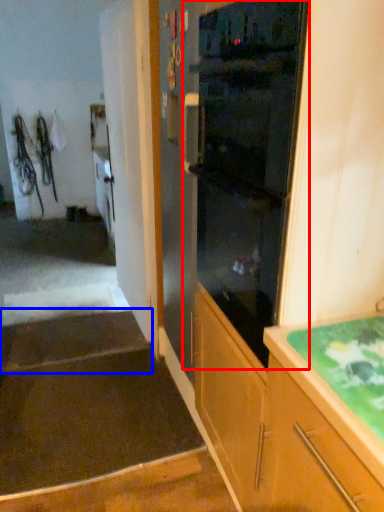
Question: Which of the following is the closest to the observer, home appliance (highlighted by a red box) or stairwell (highlighted by a blue box)?

Choices:
 (A) home appliance
 (B) stairwell

Answer: (A)